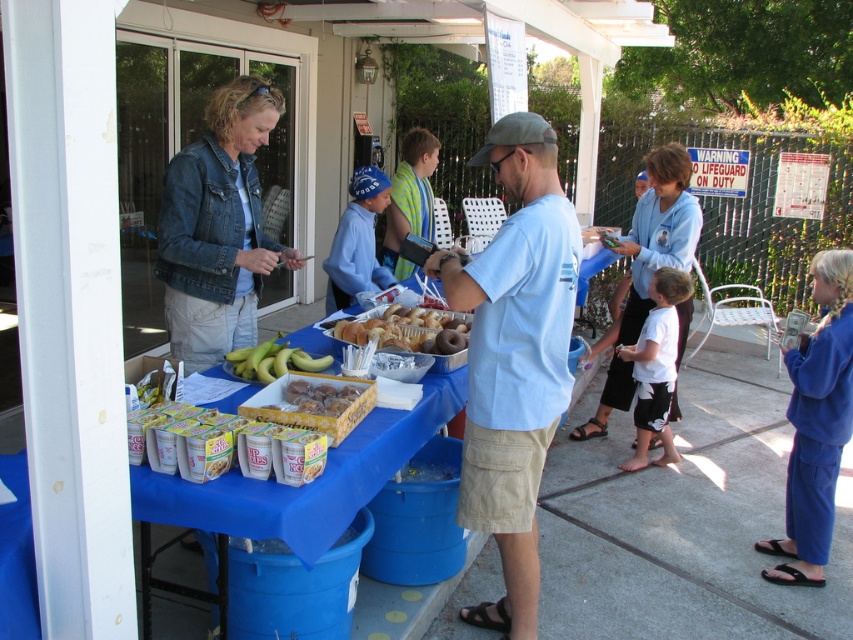
Who is higher up, white cotton shirt at center or yellow matte bananas at center?

white cotton shirt at center is higher up.

Consider the image. Is white cotton shirt at center smaller than yellow matte bananas at center?

No.

Describe the element at coordinates (654, 237) in the screenshot. I see `white cotton shirt at center` at that location.

Where is `white cotton shirt at center`? This screenshot has height=640, width=853. white cotton shirt at center is located at coordinates (654, 237).

Is golden brown glazed donuts at center further to the viewer compared to yellow matte bananas at center?

Yes, it is.

Who is lower down, golden brown glazed donuts at center or yellow matte bananas at center?

yellow matte bananas at center is below.

Which is in front, point (370, 333) or point (247, 372)?

Point (247, 372)

Where is `golden brown glazed donuts at center`? Image resolution: width=853 pixels, height=640 pixels. golden brown glazed donuts at center is located at coordinates (405, 326).

Does blue fleece pants at lower right appear on the left side of golden brown glazed donuts at center?

In fact, blue fleece pants at lower right is to the right of golden brown glazed donuts at center.

Is blue fleece pants at lower right thinner than golden brown glazed donuts at center?

Yes, blue fleece pants at lower right is thinner than golden brown glazed donuts at center.

Identify the location of blue fleece pants at lower right. (816, 426).

Locate an element on the screen. Image resolution: width=853 pixels, height=640 pixels. blue fleece pants at lower right is located at coordinates (816, 426).